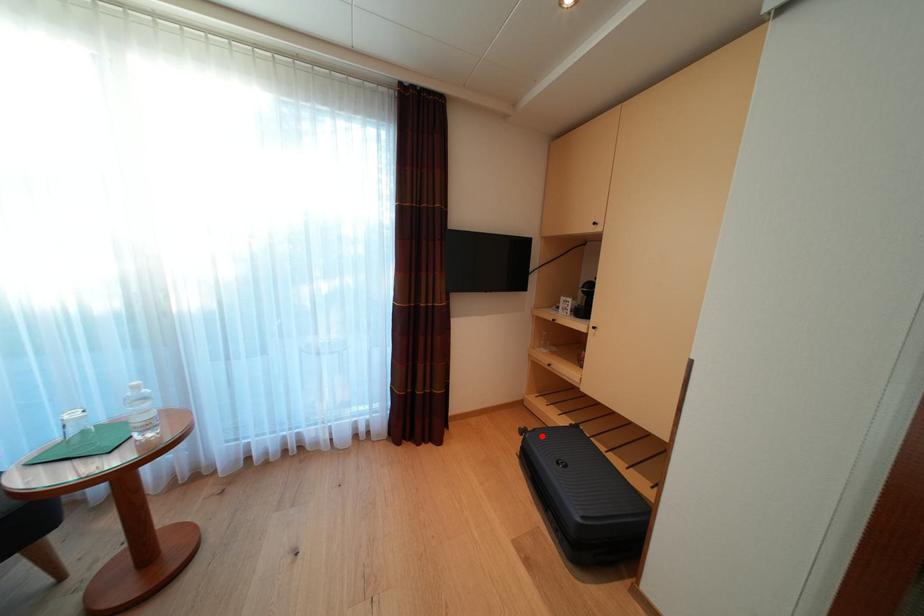
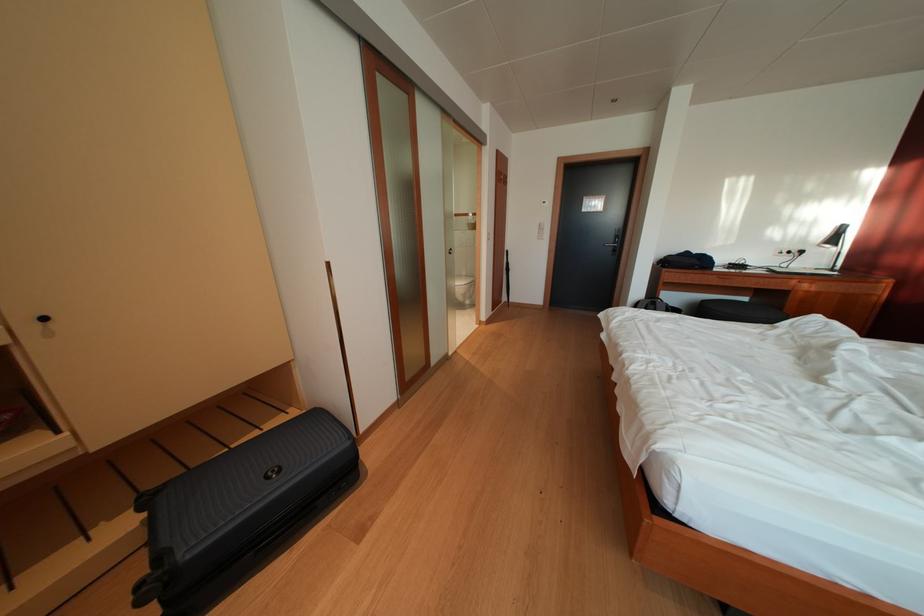
Question: I am providing you with two images of the same scene from different viewpoints. Given a red point in image1, look at the same physical point in image2. Is it:

Choices:
 (A) Closer to the viewpoint
 (B) Farther from the viewpoint

Answer: (B)